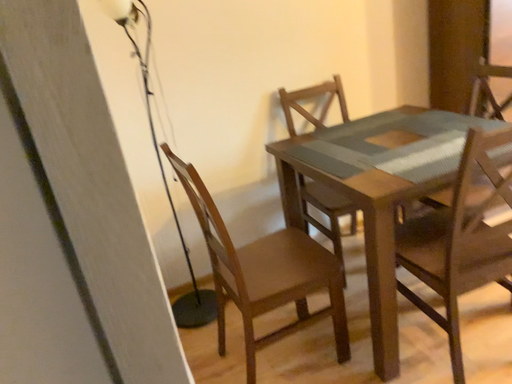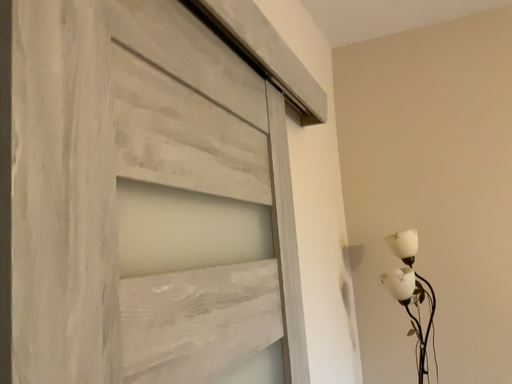
Question: How did the camera likely rotate when shooting the video?

Choices:
 (A) rotated upward
 (B) rotated downward

Answer: (A)